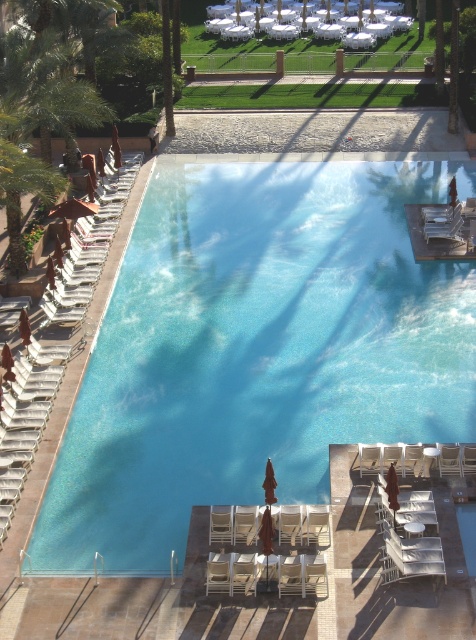
You are a guest at the resort and want to place your beach towel on the beige fabric beach chair at lower center without it being in direct sunlight. Given that the green leafy palm tree at left provides shade, can you confirm if the beach chair is under the tree? Please explain.

The green leafy palm tree at left is located above the beige fabric beach chair at lower center, so yes, the beach chair is under the tree and therefore in the shade provided by the palm tree.

You are a guest at the resort and want to know which object in the scene is wider. Based on the clear glass swimming pool at center and the green leafy palm tree at left, which one has a greater width?

The clear glass swimming pool at center has a greater width than the green leafy palm tree at left according to the description.